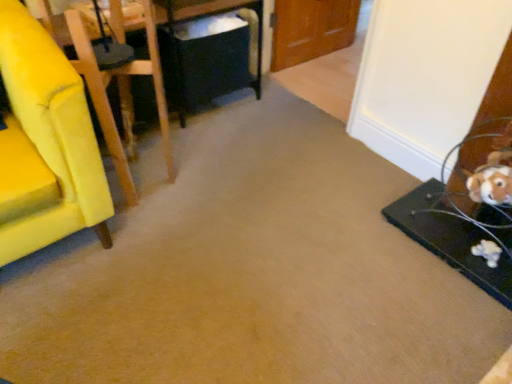
Describe the element at coordinates (176, 62) in the screenshot. I see `black plastic table at center, which ranks as the first table in top-to-bottom order` at that location.

I want to click on black plastic table at center, the second table when ordered from right to left, so click(x=176, y=62).

Image resolution: width=512 pixels, height=384 pixels. I want to click on yellow fabric chair at left, so click(122, 88).

What is the approximate width of yellow fabric chair at left?

It is 12.50 inches.

The height and width of the screenshot is (384, 512). I want to click on black plastic table at center, marked as the 2th table in a bottom-to-top arrangement, so click(176, 62).

Considering the relative positions of yellow fabric chair at left and black plastic table at center, the second table when ordered from right to left, in the image provided, is yellow fabric chair at left to the left of black plastic table at center, the second table when ordered from right to left, from the viewer's perspective?

Yes.

You are a GUI agent. You are given a task and a screenshot of the screen. Output one action in this format:
    pyautogui.click(x=<x>, y=<y>)
    Task: Click on the chair in front of the black plastic table at center, which ranks as the first table in top-to-bottom order
    
    Given the screenshot: What is the action you would take?
    pyautogui.click(x=122, y=88)

Who is more distant, yellow fabric chair at left or black plastic table at center, which appears as the 1th table when viewed from the left?

black plastic table at center, which appears as the 1th table when viewed from the left, is more distant.

From their relative heights in the image, would you say yellow fabric chair at left is taller or shorter than black plastic table at center, which appears as the second table when viewed from the front?

Clearly, yellow fabric chair at left is taller compared to black plastic table at center, which appears as the second table when viewed from the front.

Based on the photo, from a real-world perspective, does yellow fabric chair at left sit lower than black matte table at right, which appears as the 1th table when viewed from the right?

Incorrect, from a real-world perspective, yellow fabric chair at left is higher than black matte table at right, which appears as the 1th table when viewed from the right.

From a real-world perspective, which table is the 2nd one underneath the yellow fabric chair at left? Please provide its 2D coordinates.

[(450, 239)]

Is black matte table at right, arranged as the second table when viewed from the top, located within yellow fabric chair at left?

No, yellow fabric chair at left does not contain black matte table at right, arranged as the second table when viewed from the top.

How distant is yellow fabric chair at left from black matte table at right, the first table positioned from the bottom?

yellow fabric chair at left is 3.70 feet from black matte table at right, the first table positioned from the bottom.

From a real-world perspective, relative to yellow fabric chair at left, is black matte table at right, which appears as the 1th table when viewed from the right, vertically above or below?

In terms of real-world spatial position, black matte table at right, which appears as the 1th table when viewed from the right, is below yellow fabric chair at left.

Which of these two, black matte table at right, the first table positioned from the bottom, or yellow fabric chair at left, is wider?

With larger width is black matte table at right, the first table positioned from the bottom.

Is black matte table at right, placed as the 2th table when sorted from left to right, positioned far away from yellow fabric chair at left?

black matte table at right, placed as the 2th table when sorted from left to right, is far away from yellow fabric chair at left.

Can you confirm if black matte table at right, which is the second table from back to front, is smaller than yellow fabric chair at left?

Yes.

Is black plastic table at center, which appears as the 1th table when viewed from the left, positioned behind black matte table at right, placed as the 2th table when sorted from left to right?

That is True.

Based on their positions, is black plastic table at center, arranged as the first table when viewed from the back, located to the left or right of black matte table at right, which is the second table from back to front?

From the image, it's evident that black plastic table at center, arranged as the first table when viewed from the back, is to the left of black matte table at right, which is the second table from back to front.

Is the surface of black plastic table at center, which appears as the 1th table when viewed from the left, in direct contact with black matte table at right, marked as the first table in a front-to-back arrangement?

No, black plastic table at center, which appears as the 1th table when viewed from the left, is not with black matte table at right, marked as the first table in a front-to-back arrangement.

Could you tell me if black plastic table at center, arranged as the first table when viewed from the back, is facing black matte table at right, which is the second table from back to front?

Yes, black plastic table at center, arranged as the first table when viewed from the back, is turned towards black matte table at right, which is the second table from back to front.

Which of these two, black matte table at right, which is the second table from back to front, or black plastic table at center, which ranks as the first table in top-to-bottom order, stands taller?

Standing taller between the two is black plastic table at center, which ranks as the first table in top-to-bottom order.

Could you measure the distance between black matte table at right, which appears as the 1th table when viewed from the right, and black plastic table at center, which appears as the 1th table when viewed from the left?

black matte table at right, which appears as the 1th table when viewed from the right, and black plastic table at center, which appears as the 1th table when viewed from the left, are 4.34 feet apart from each other.

At what (x,y) coordinates should I click in order to perform the action: click on table behind the black matte table at right, which is the second table from back to front. Please return your answer as a coordinate pair (x, y). The height and width of the screenshot is (384, 512). Looking at the image, I should click on (176, 62).

Which point is more distant from viewer, (467,235) or (180,124)?

The point (180,124) is more distant.

How different are the orientations of black plastic table at center, arranged as the first table when viewed from the back, and yellow fabric chair at left in degrees?

The facing directions of black plastic table at center, arranged as the first table when viewed from the back, and yellow fabric chair at left are 9.54 degrees apart.

Considering the positions of point (172, 8) and point (152, 74), is point (172, 8) closer or farther from the camera than point (152, 74)?

Point (172, 8) is positioned farther from the camera compared to point (152, 74).

Is black plastic table at center, marked as the 2th table in a bottom-to-top arrangement, with yellow fabric chair at left?

They are not placed beside each other.

Considering the sizes of objects black plastic table at center, arranged as the first table when viewed from the back, and yellow fabric chair at left in the image provided, who is thinner, black plastic table at center, arranged as the first table when viewed from the back, or yellow fabric chair at left?

With smaller width is yellow fabric chair at left.

The width and height of the screenshot is (512, 384). I want to click on the 2nd table behind when counting from the yellow fabric chair at left, so click(176, 62).

This screenshot has height=384, width=512. I want to click on chair located above the black matte table at right, placed as the 2th table when sorted from left to right (from the image's perspective), so click(x=122, y=88).

Looking at the image, which one is located further to black plastic table at center, the second table when ordered from right to left, black matte table at right, which appears as the 1th table when viewed from the right, or yellow fabric chair at left?

black matte table at right, which appears as the 1th table when viewed from the right, is positioned further to the anchor black plastic table at center, the second table when ordered from right to left.

Estimate the real-world distances between objects in this image. Which object is further from yellow fabric chair at left, black matte table at right, which appears as the 1th table when viewed from the right, or black plastic table at center, marked as the 2th table in a bottom-to-top arrangement?

The object further to yellow fabric chair at left is black matte table at right, which appears as the 1th table when viewed from the right.

Looking at the image, which one is located closer to black matte table at right, which appears as the 1th table when viewed from the right, yellow fabric chair at left or black plastic table at center, arranged as the first table when viewed from the back?

yellow fabric chair at left.

From the image, which object appears to be farther from black plastic table at center, which appears as the second table when viewed from the front, yellow fabric chair at left or black matte table at right, which appears as the 1th table when viewed from the right?

black matte table at right, which appears as the 1th table when viewed from the right, is further to black plastic table at center, which appears as the second table when viewed from the front.

From the image, which object appears to be nearer to yellow fabric chair at left, black plastic table at center, marked as the 2th table in a bottom-to-top arrangement, or black matte table at right, which appears as the 1th table when viewed from the right?

black plastic table at center, marked as the 2th table in a bottom-to-top arrangement, is closer to yellow fabric chair at left.

Looking at the image, which one is located closer to black matte table at right, placed as the 2th table when sorted from left to right, black plastic table at center, which ranks as the first table in top-to-bottom order, or yellow fabric chair at left?

Based on the image, yellow fabric chair at left appears to be nearer to black matte table at right, placed as the 2th table when sorted from left to right.

This screenshot has width=512, height=384. Find the location of `table situated between yellow fabric chair at left and black matte table at right, marked as the first table in a front-to-back arrangement, from left to right`. table situated between yellow fabric chair at left and black matte table at right, marked as the first table in a front-to-back arrangement, from left to right is located at coordinates (176, 62).